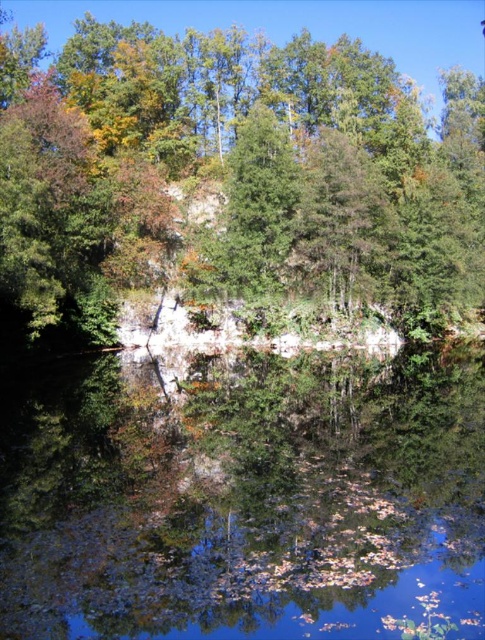
Based on the photo, you are standing at the edge of the water and want to retrieve a small item that fell into the clear water at center. If you can reach 20 feet, will you be able to reach it?

The clear water at center is 21.68 feet away from the viewer, so you cannot reach it since your maximum reach is 20 feet.

You are standing at point [244,499] in the image. What do you see directly in front of you?

At point [244,499] lies clear water at center.